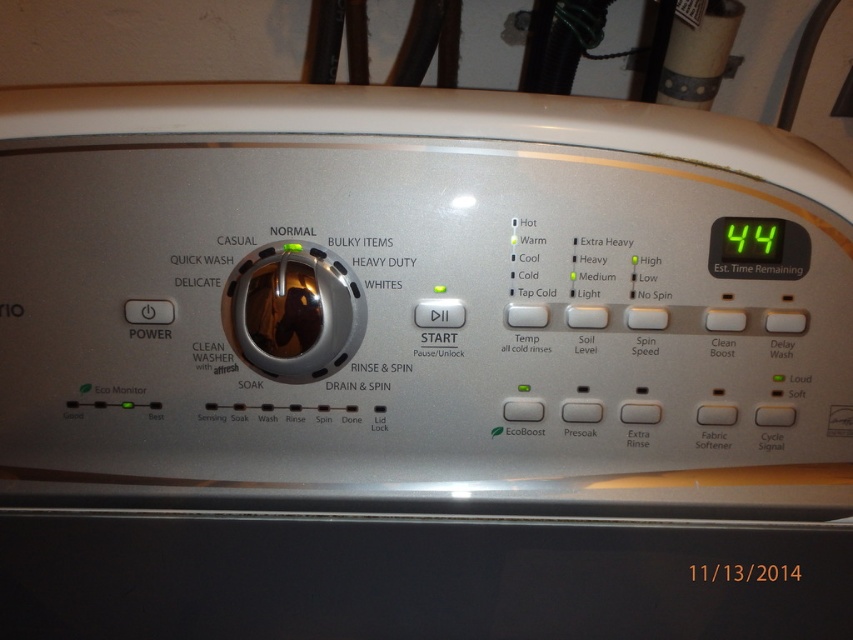
Does satin silver knob at center appear on the right side of green digital display at upper right?

No, satin silver knob at center is not to the right of green digital display at upper right.

Is satin silver knob at center above green digital display at upper right?

Actually, satin silver knob at center is below green digital display at upper right.

Image resolution: width=853 pixels, height=640 pixels. Describe the element at coordinates (293, 310) in the screenshot. I see `satin silver knob at center` at that location.

At what (x,y) coordinates should I click in order to perform the action: click on satin silver knob at center. Please return your answer as a coordinate pair (x, y). The width and height of the screenshot is (853, 640). Looking at the image, I should click on (293, 310).